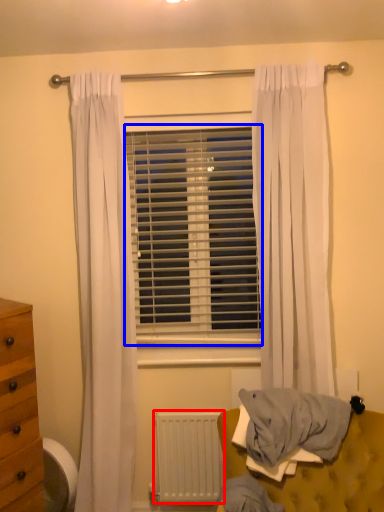
Question: Which of the following is the farthest to the observer, radiator (highlighted by a red box) or window blind (highlighted by a blue box)?

Choices:
 (A) radiator
 (B) window blind

Answer: (B)